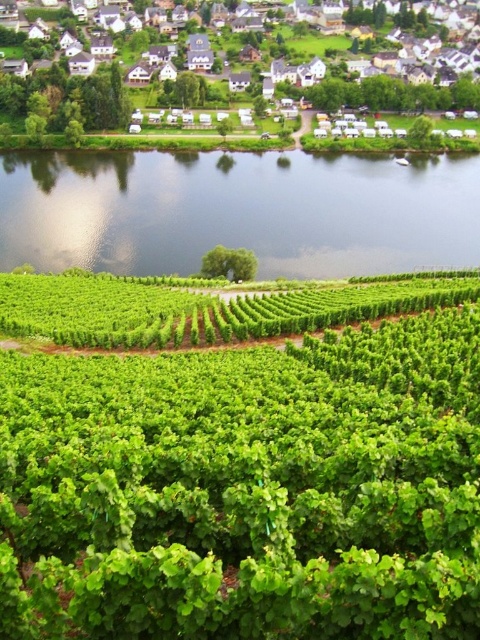
Question: Which is farther from the green leafy river at center?

Choices:
 (A) white wooden houses at upper center
 (B) green leafy vines at center

Answer: (A)

Question: Does green leafy river at center have a larger size compared to white wooden houses at upper center?

Choices:
 (A) yes
 (B) no

Answer: (B)

Question: Which of the following is the closest to the observer?

Choices:
 (A) white wooden houses at upper center
 (B) green leafy river at center
 (C) green leafy vines at center

Answer: (C)

Question: Does green leafy river at center have a lesser width compared to white wooden houses at upper center?

Choices:
 (A) yes
 (B) no

Answer: (A)

Question: Which point is closer to the camera taking this photo?

Choices:
 (A) (285, 406)
 (B) (15, 113)
 (C) (348, 211)

Answer: (A)

Question: Can you confirm if green leafy vines at center is smaller than white wooden houses at upper center?

Choices:
 (A) no
 (B) yes

Answer: (B)